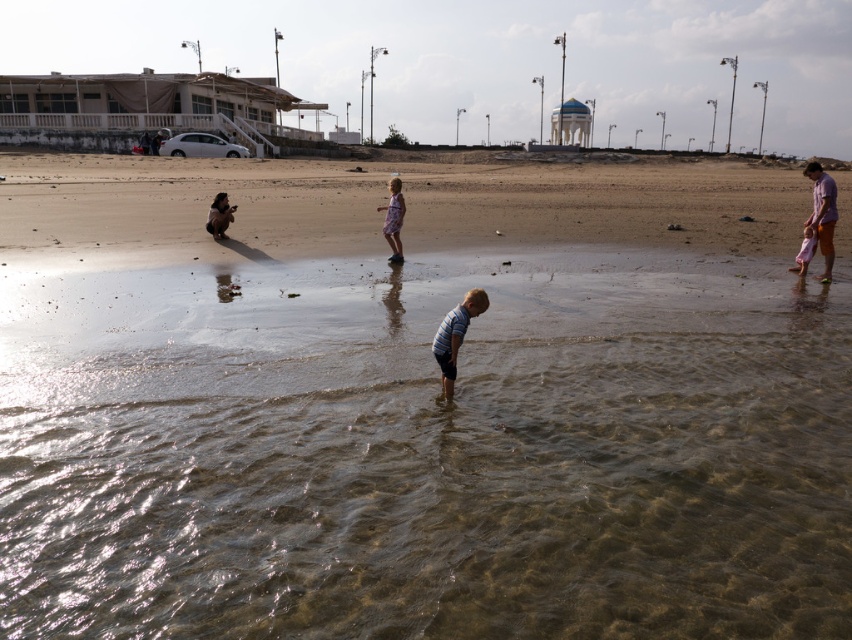
You are a beachgoer who wants to wade into the water without getting your orange cotton shorts at right wet. Based on the scene, is the clear water at lower center shallow enough to do so?

The clear water at lower center has a lesser height compared to orange cotton shorts at right, so yes, the water is shallow enough to wade in without getting the orange cotton shorts at right wet.

You are standing at the point with coordinates (822, 212) in the beach scene. What object are you standing on?

You are standing on the orange cotton shorts at right.

You are standing at the waterline and want to hand a beach towel to the person in orange cotton shorts at right and the person in floral dress at center. Which one is closer to you?

The floral dress at center is closer to you because the orange cotton shorts at right is to the right of floral dress at center, meaning the floral dress at center is positioned between you and the orange cotton shorts at right.